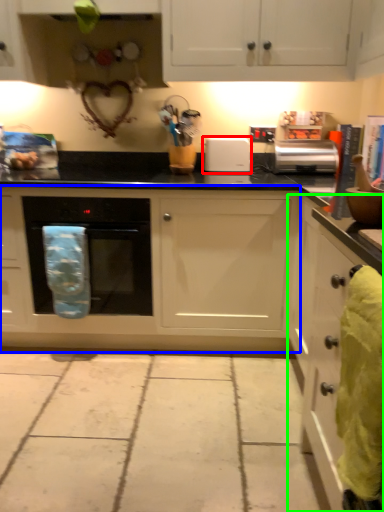
Question: Based on their relative distances, which object is nearer to appliance (highlighted by a red box)? Choose from cabinetry (highlighted by a blue box) and cabinetry (highlighted by a green box).

Choices:
 (A) cabinetry
 (B) cabinetry

Answer: (A)